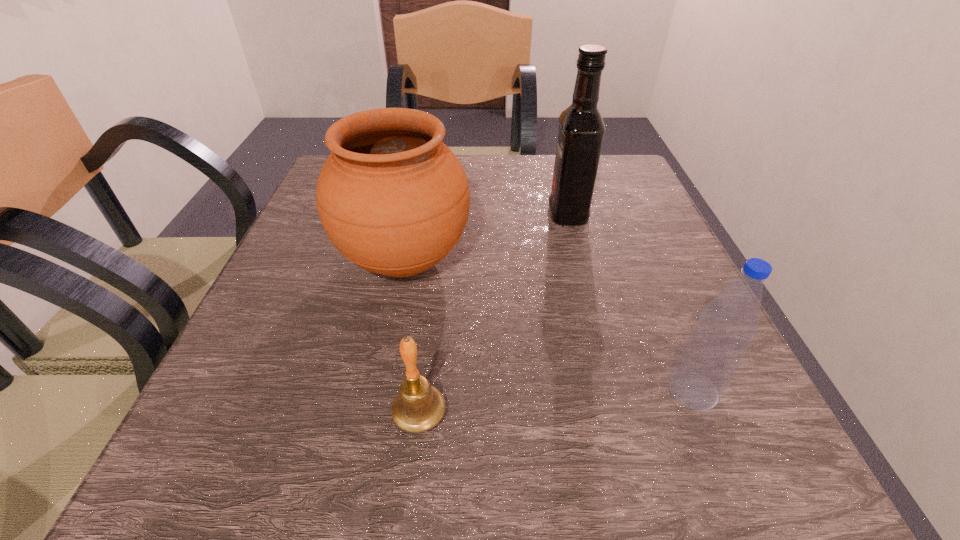
Identify the location of empty location between the liquor and the bell. The height and width of the screenshot is (540, 960). (493, 314).

Locate an element on the screen. vacant point located between the rightmost object and the third object from left to right is located at coordinates (631, 302).

Identify which object is the third nearest to the third object from left to right. Please provide its 2D coordinates. Your answer should be formatted as a tuple, i.e. [(x, y)], where the tuple contains the x and y coordinates of a point satisfying the conditions above.

[(418, 407)]

Choose which object is the third nearest neighbor to the water bottle. Please provide its 2D coordinates. Your answer should be formatted as a tuple, i.e. [(x, y)], where the tuple contains the x and y coordinates of a point satisfying the conditions above.

[(581, 127)]

The height and width of the screenshot is (540, 960). I want to click on free space that satisfies the following two spatial constraints: 1. on the front-facing side of the liquor; 2. on the back side of the water bottle, so click(614, 390).

Locate an element on the screen. The width and height of the screenshot is (960, 540). vacant region that satisfies the following two spatial constraints: 1. on the back side of the water bottle; 2. on the front-facing side of the third object from left to right is located at coordinates (619, 214).

The image size is (960, 540). In order to click on vacant point that satisfies the following two spatial constraints: 1. on the front side of the rightmost object; 2. on the left side of the pottery in this screenshot , I will do `click(379, 390)`.